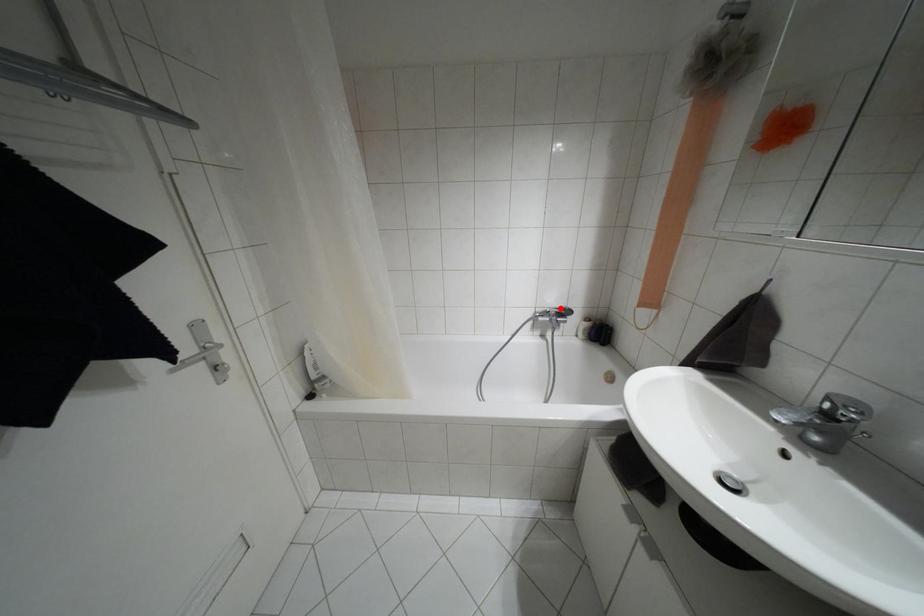
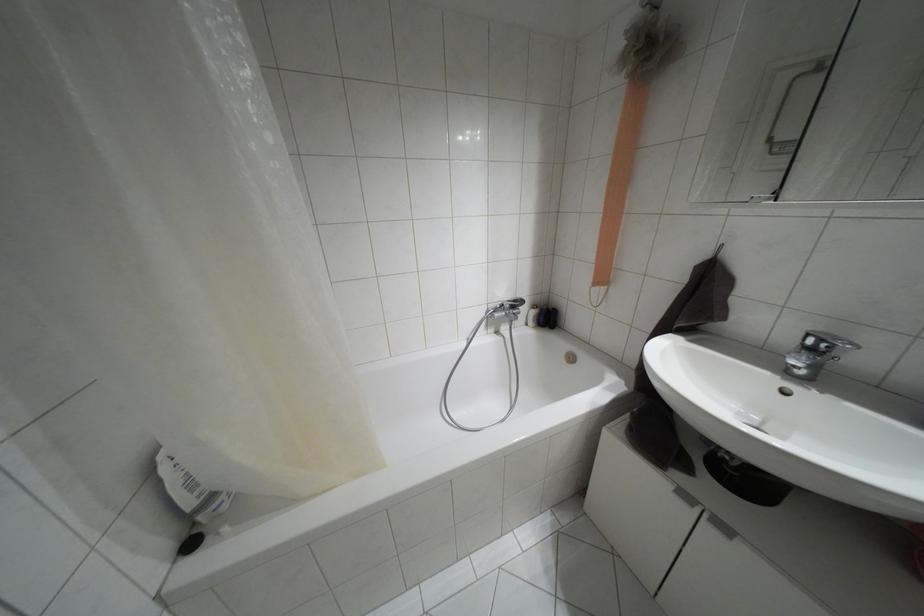
Locate, in the second image, the point that corresponds to the highlighted location in the first image.

(514, 301)